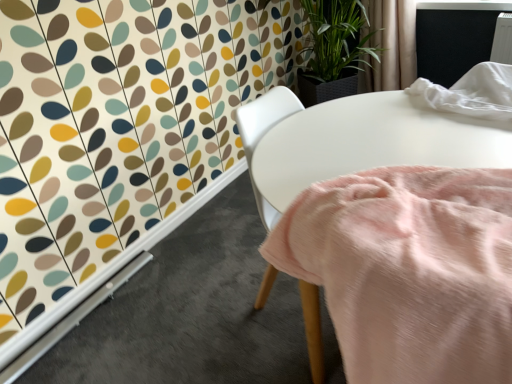
Question: Visually, is beige fabric curtain at upper right positioned to the left or to the right of pink soft fabric at center?

Choices:
 (A) right
 (B) left

Answer: (A)

Question: From a real-world perspective, is beige fabric curtain at upper right physically located above or below pink soft fabric at center?

Choices:
 (A) below
 (B) above

Answer: (B)

Question: Is beige fabric curtain at upper right situated inside pink soft fabric at center or outside?

Choices:
 (A) inside
 (B) outside

Answer: (B)

Question: Would you say pink soft fabric at center is to the left or to the right of beige fabric curtain at upper right in the picture?

Choices:
 (A) left
 (B) right

Answer: (A)

Question: Does point (390, 122) appear closer or farther from the camera than point (381, 18)?

Choices:
 (A) closer
 (B) farther

Answer: (A)

Question: Looking at their shapes, would you say pink soft fabric at center is wider or thinner than beige fabric curtain at upper right?

Choices:
 (A) wide
 (B) thin

Answer: (A)

Question: From a real-world perspective, is pink soft fabric at center above or below beige fabric curtain at upper right?

Choices:
 (A) below
 (B) above

Answer: (A)